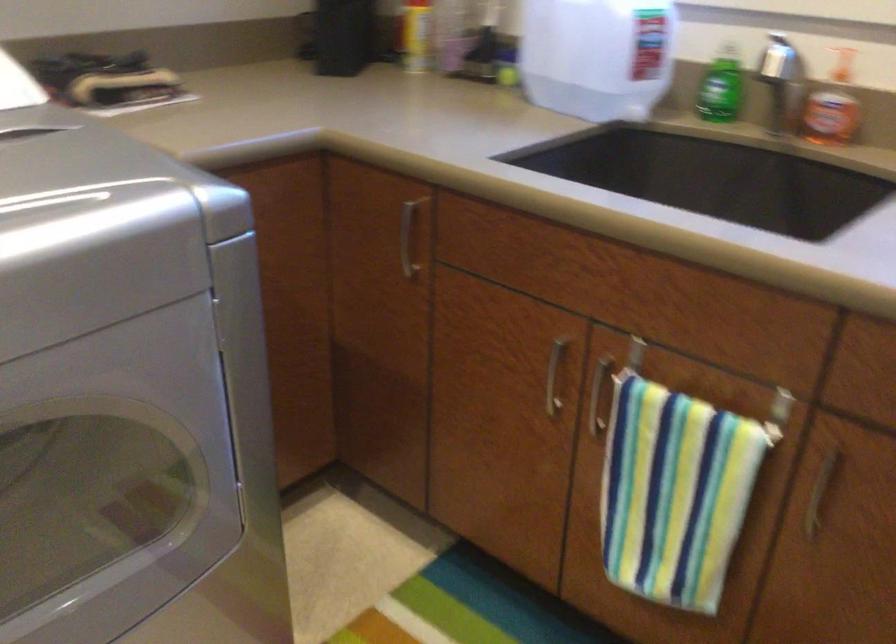
Describe the element at coordinates (721, 88) in the screenshot. The image size is (896, 644). I see `the green soap bottle` at that location.